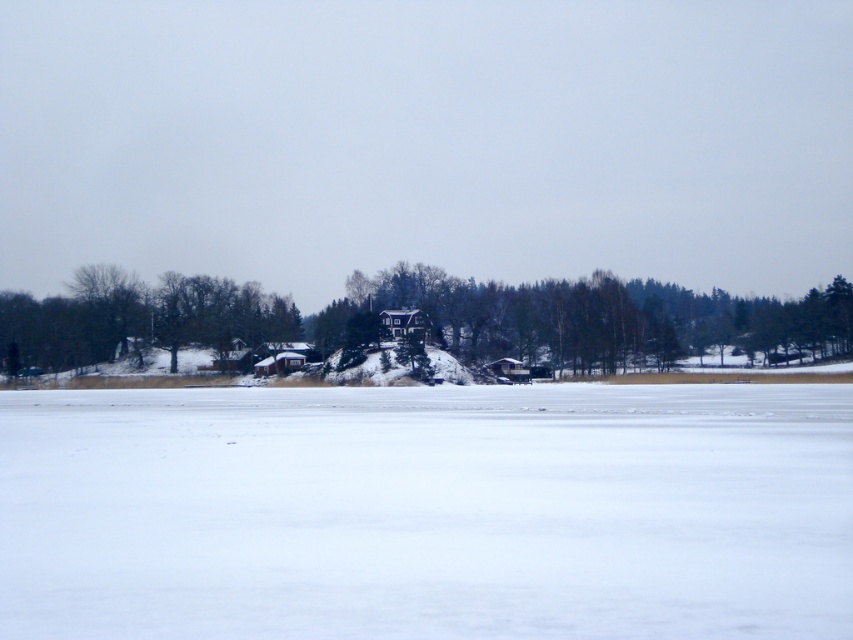
You are standing at the edge of the frozen water and see the white matte snow at center and the green matte tree at center. Which object is closer to you?

The white matte snow at center is closer to you because it is in front of the green matte tree at center.

You are planning to build a snowman using the white matte snow at center and want to place it near the green matte tree at center. Considering the sizes of both objects, which one is wider?

The white matte snow at center is narrower than the green matte tree at center, so the tree is wider.